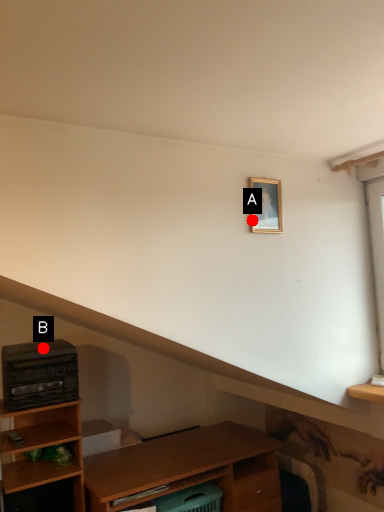
Question: Two points are circled on the image, labeled by A and B beside each circle. Which point is farther from the camera taking this photo?

Choices:
 (A) A is further
 (B) B is further

Answer: (B)